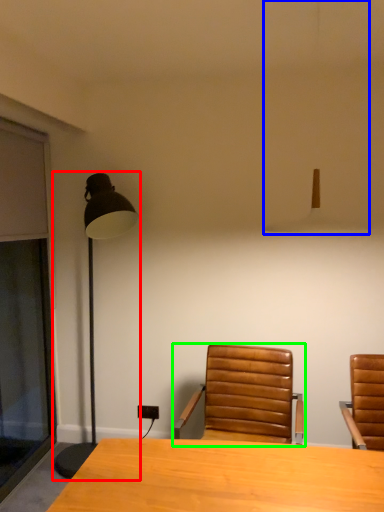
Question: Considering the real-world distances, which object is farthest from lamp (highlighted by a red box)? lamp (highlighted by a blue box) or chair (highlighted by a green box)?

Choices:
 (A) lamp
 (B) chair

Answer: (B)